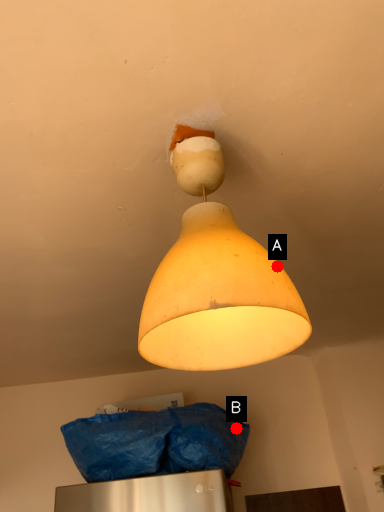
Question: Two points are circled on the image, labeled by A and B beside each circle. Among these points, which one is nearest to the camera?

Choices:
 (A) A is closer
 (B) B is closer

Answer: (A)